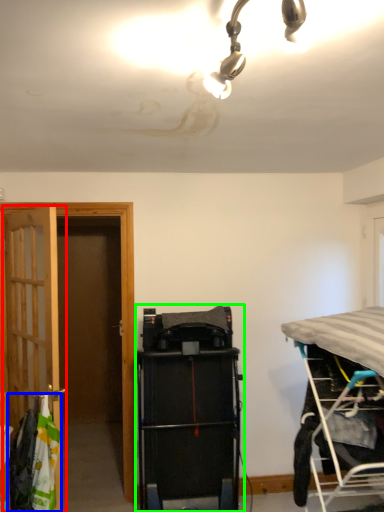
Question: Which object is positioned closest to door (highlighted by a red box)? Select from laundry (highlighted by a blue box) and equipment (highlighted by a green box).

Choices:
 (A) laundry
 (B) equipment

Answer: (A)